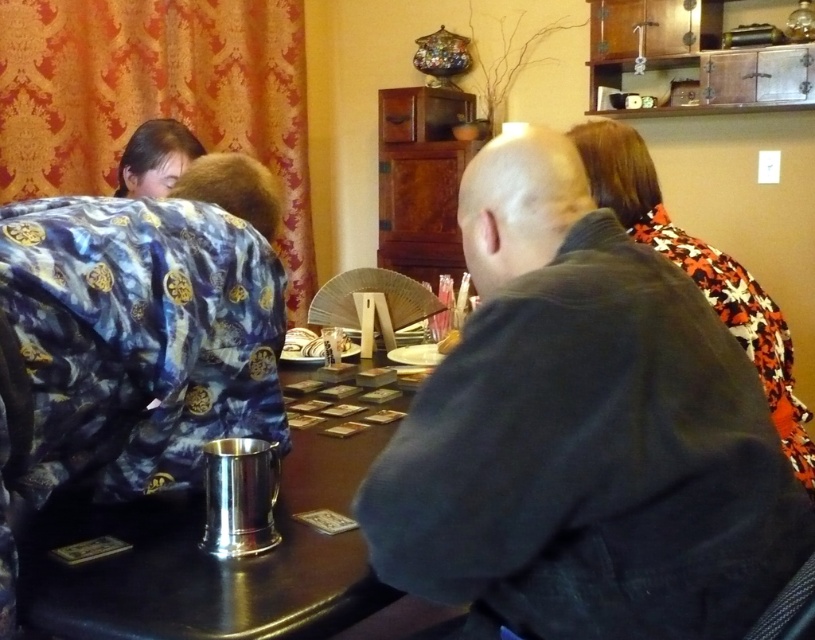
Question: Is dark gray jacket at center behind floral-patterned fabric at upper right?

Choices:
 (A) no
 (B) yes

Answer: (A)

Question: Which point appears closest to the camera in this image?

Choices:
 (A) (192, 144)
 (B) (514, 186)

Answer: (B)

Question: Does floral-patterned fabric at upper right have a larger size compared to smooth brown hair at upper left?

Choices:
 (A) no
 (B) yes

Answer: (B)

Question: Based on their relative distances, which object is nearer to the dark gray jacket at center?

Choices:
 (A) floral-patterned fabric at upper right
 (B) smooth brown hair at upper left
 (C) shiny silver cup at center

Answer: (C)

Question: Among these points, which one is farthest from the camera?

Choices:
 (A) (139, 168)
 (B) (789, 456)
 (C) (677, 316)
 (D) (146, 282)

Answer: (A)

Question: Does dark gray jacket at center appear on the right side of smooth brown hair at upper left?

Choices:
 (A) no
 (B) yes

Answer: (B)